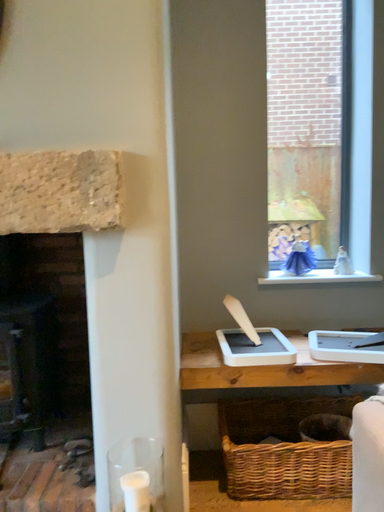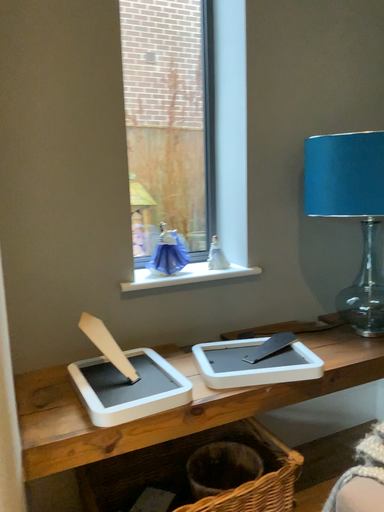
Question: How did the camera likely rotate when shooting the video?

Choices:
 (A) rotated left
 (B) rotated right

Answer: (B)